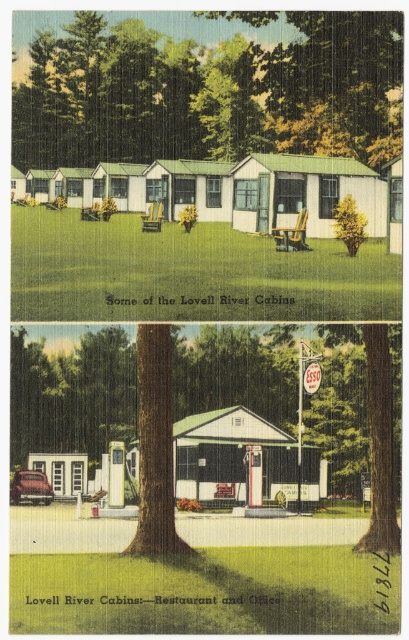
You are standing at the edge of the Lovell River Cabins area and want to reach the green textured tree at center. Given that the average walking speed is 1.4 meters per second, approximately how many seconds will it take you to walk directly to the tree?

The distance between you and the green textured tree at center is 17.01 meters. At an average walking speed of 1.4 meters per second, dividing the distance by the speed gives approximately 12.15 seconds. Therefore, it will take roughly 12 seconds to reach the tree.

You are a visitor standing in front of the vintage postcard of Lovell River Cabins. You notice two green trees in the scene. Which tree is positioned closer to you, the green textured tree at center or the green leafy tree at upper center?

The green textured tree at center is closer to the viewer than the green leafy tree at upper center.

You are planning to set up a picnic blanket between the green textured tree at center and the green leafy tree at upper center. Which tree has a wider trunk to ensure the blanket fits comfortably between them?

The green leafy tree at upper center has a greater width than the green textured tree at center, so the picnic blanket should be placed between them to accommodate the wider trunk.